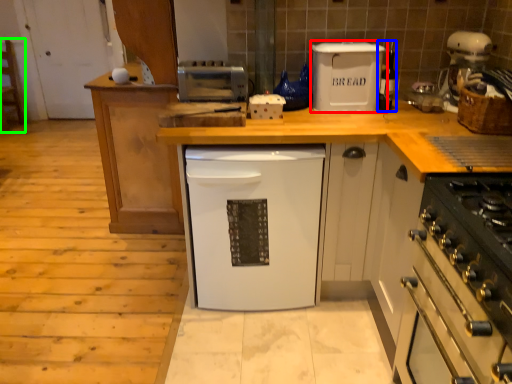
Question: Which object is the closest to the kitchen appliance (highlighted by a red box)? Choose among these: appliance (highlighted by a blue box) or chair (highlighted by a green box).

Choices:
 (A) appliance
 (B) chair

Answer: (A)